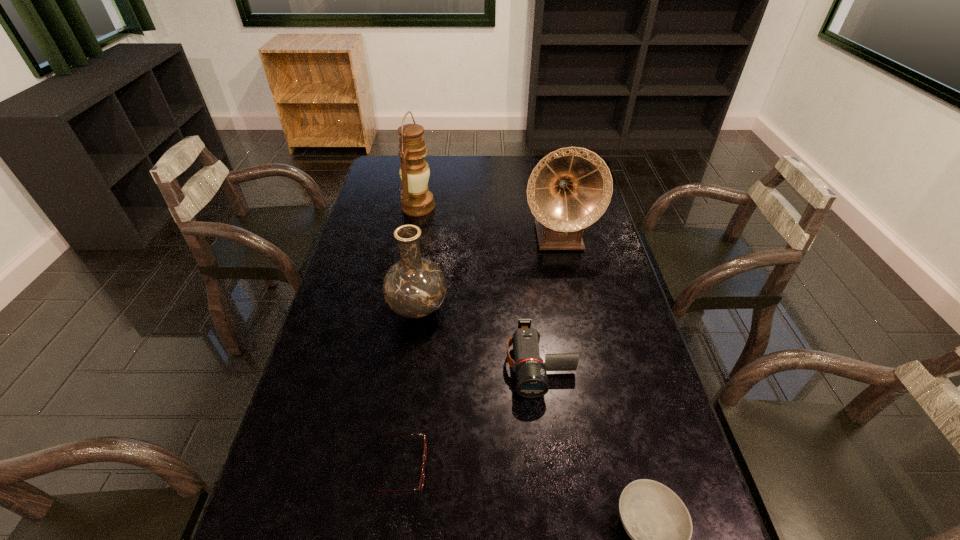
Locate an element on the screen. This screenshot has width=960, height=540. free location located on the lens of the third shortest object is located at coordinates (554, 482).

I want to click on free space located on the lenses of the shortest object, so click(x=559, y=468).

Locate an element on the screen. object present at the left edge is located at coordinates (417, 200).

This screenshot has width=960, height=540. What are the coordinates of `object at the right edge` in the screenshot? It's located at (569, 189).

In the image, there is a desktop. Where is `vacant space at the far edge`? The image size is (960, 540). vacant space at the far edge is located at coordinates (527, 160).

Locate an element on the screen. Image resolution: width=960 pixels, height=540 pixels. free spot at the left edge of the desktop is located at coordinates (385, 221).

The width and height of the screenshot is (960, 540). I want to click on vacant region at the right edge of the desktop, so click(613, 399).

This screenshot has width=960, height=540. In the image, there is a desktop. Find the location of `vacant space at the far left corner`. vacant space at the far left corner is located at coordinates (378, 177).

In order to click on vacant space that is in between the fourth tallest object and the oil lamp in this screenshot , I will do `click(479, 286)`.

At what (x,y) coordinates should I click in order to perform the action: click on vacant point located between the shortest object and the phonograph record. Please return your answer as a coordinate pair (x, y). Image resolution: width=960 pixels, height=540 pixels. Looking at the image, I should click on (478, 352).